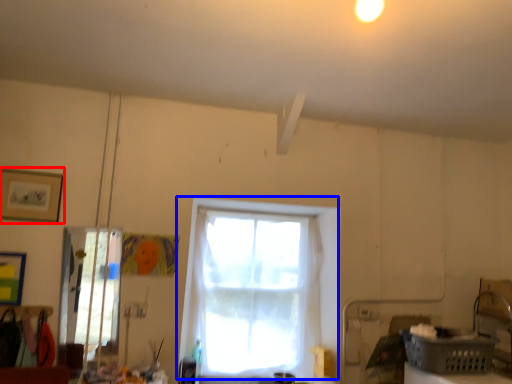
Question: Among these objects, which one is nearest to the camera, picture frame (highlighted by a red box) or window (highlighted by a blue box)?

Choices:
 (A) picture frame
 (B) window

Answer: (A)